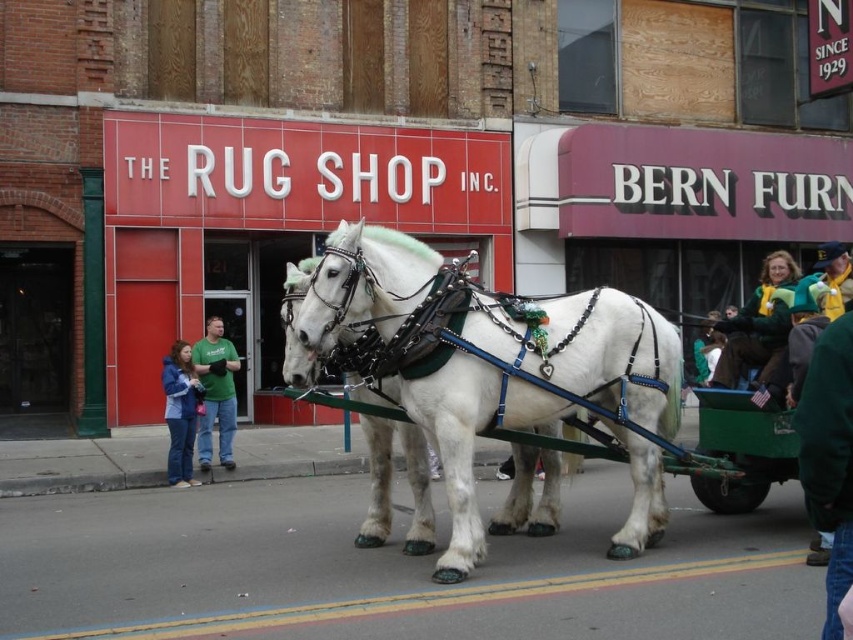
Question: Does white glossy horse at center come in front of green knitted scarf at upper right?

Choices:
 (A) no
 (B) yes

Answer: (B)

Question: Does green fuzzy jacket at lower right appear over green knitted scarf at upper right?

Choices:
 (A) no
 (B) yes

Answer: (A)

Question: Among these points, which one is nearest to the camera?

Choices:
 (A) (190, 456)
 (B) (817, 250)
 (C) (846, 460)
 (D) (747, 342)

Answer: (C)

Question: Does green cotton shirt at center have a lesser width compared to green knitted scarf at upper right?

Choices:
 (A) yes
 (B) no

Answer: (A)

Question: Which point is closer to the camera taking this photo?

Choices:
 (A) (206, 324)
 (B) (178, 483)
 (C) (822, 428)
 (D) (846, 285)

Answer: (C)

Question: Which object is farther from the camera taking this photo?

Choices:
 (A) green knitted scarf at upper right
 (B) white glossy horse at center
 (C) green cotton shirt at center
 (D) green fuzzy jacket at lower right

Answer: (C)